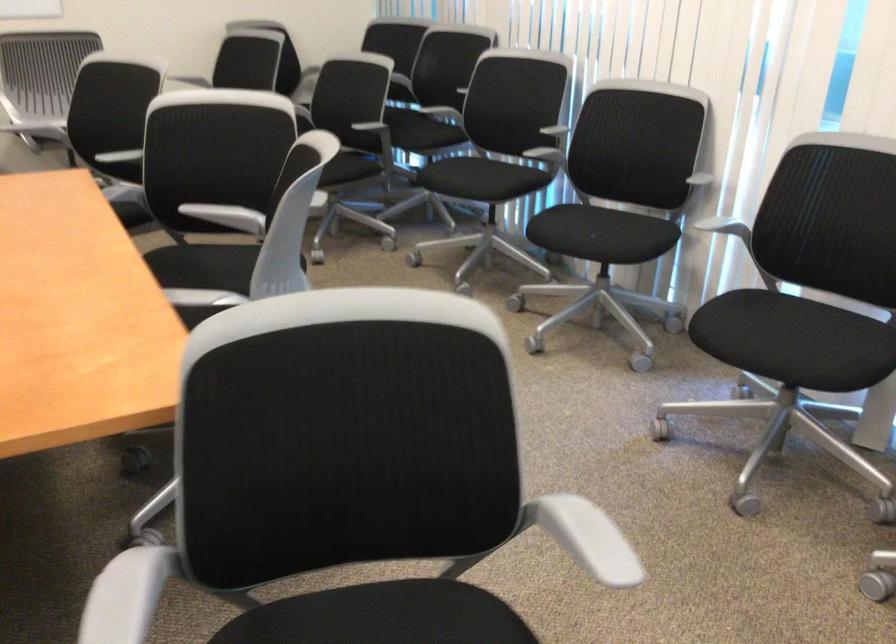
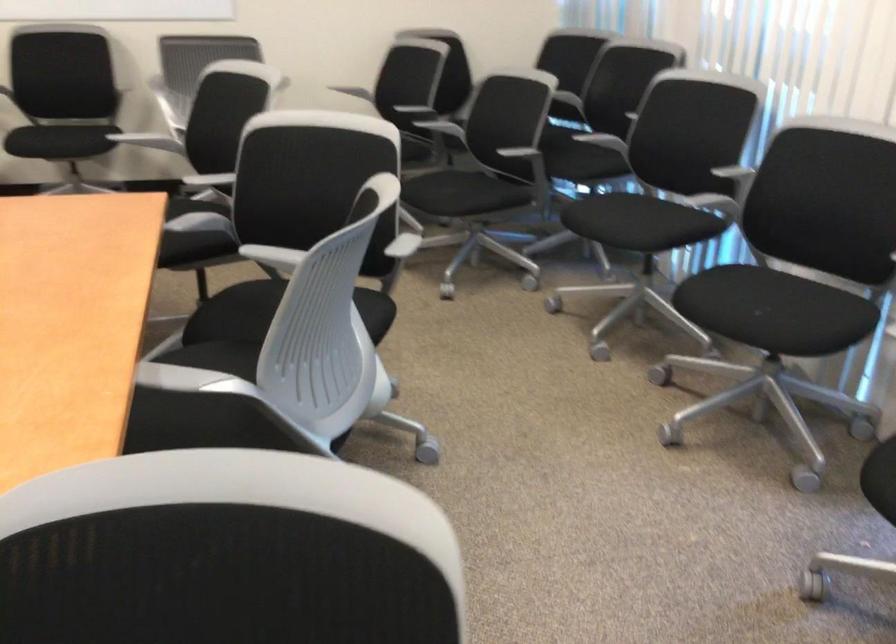
Question: I am providing you with two images of the same scene from different viewpoints. Which of the following objects are not visible in image2?

Choices:
 (A) white chair armrest
 (B) black chair sitting surface
 (C) red ladder handle
 (D) chair sitting surface

Answer: (B)